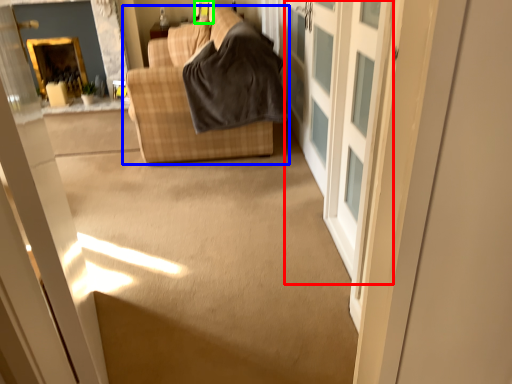
Question: Estimate the real-world distances between objects in this image. Which object is farther from barn door (highlighted by a red box), studio couch (highlighted by a blue box) or window (highlighted by a green box)?

Choices:
 (A) studio couch
 (B) window

Answer: (B)